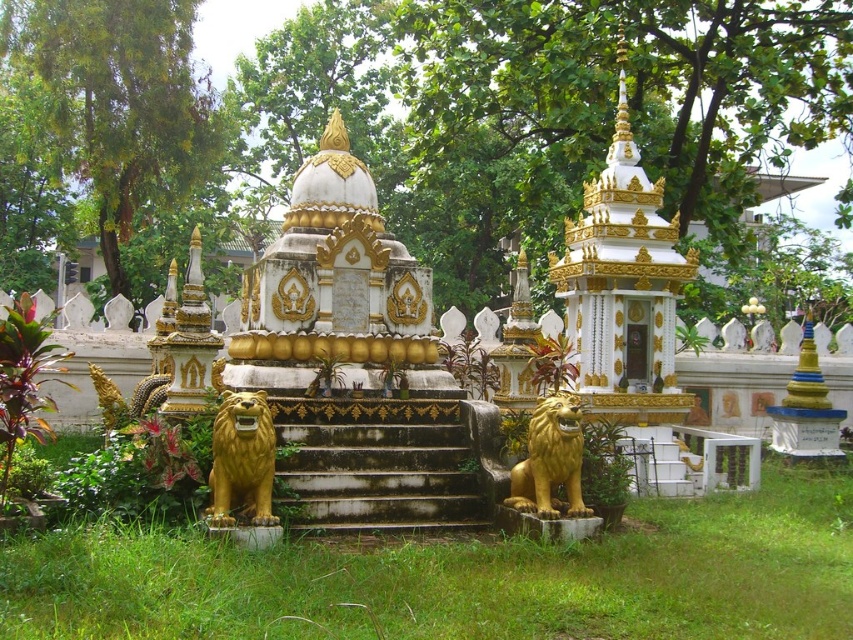
You are standing at the entrance of the outdoor setting and want to reach the central stupa. Which direction should you move relative to the stone stairs at center?

The stone stairs at center are located at point (376, 474), so you should move towards the stone stairs at center to reach the central stupa.

You are a visitor standing in front of the central stupa and see the gold polished stone lion at lower left and the gold polished lion at lower center. Which lion appears closer to you?

The gold polished stone lion at lower center appears closer to you because it is larger in size compared to the gold polished stone lion at lower left.